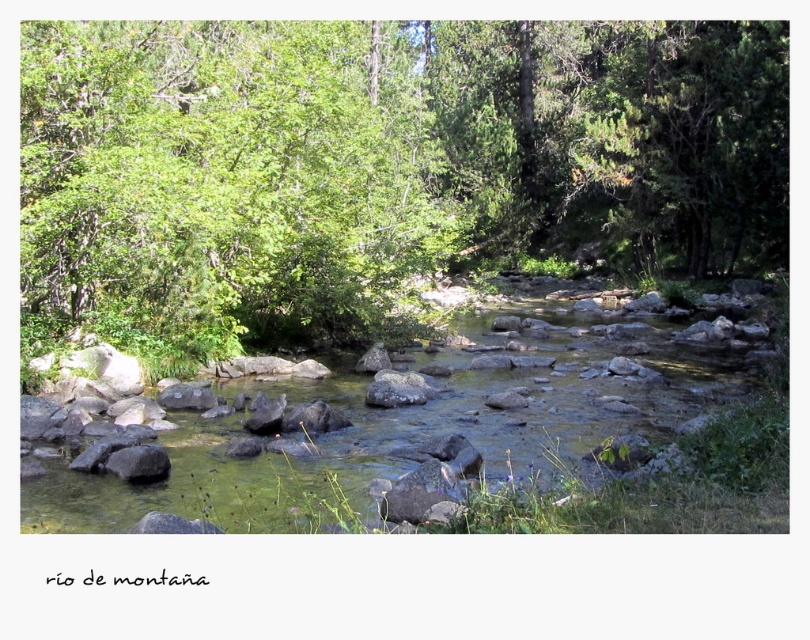
Question: Is green leafy tree at center to the right of gray rough rock at lower left from the viewer's perspective?

Choices:
 (A) yes
 (B) no

Answer: (A)

Question: Which point is closer to the camera taking this photo?

Choices:
 (A) (x=374, y=128)
 (B) (x=139, y=448)

Answer: (B)

Question: Is green leafy tree at center to the right of gray rough rock at lower left from the viewer's perspective?

Choices:
 (A) no
 (B) yes

Answer: (B)

Question: Which object appears farthest from the camera in this image?

Choices:
 (A) gray rough rock at lower left
 (B) green leafy tree at center

Answer: (B)

Question: Which point appears farthest from the camera in this image?

Choices:
 (A) (143, 445)
 (B) (749, 243)

Answer: (B)

Question: Does green leafy tree at center come in front of gray rough rock at lower left?

Choices:
 (A) no
 (B) yes

Answer: (A)